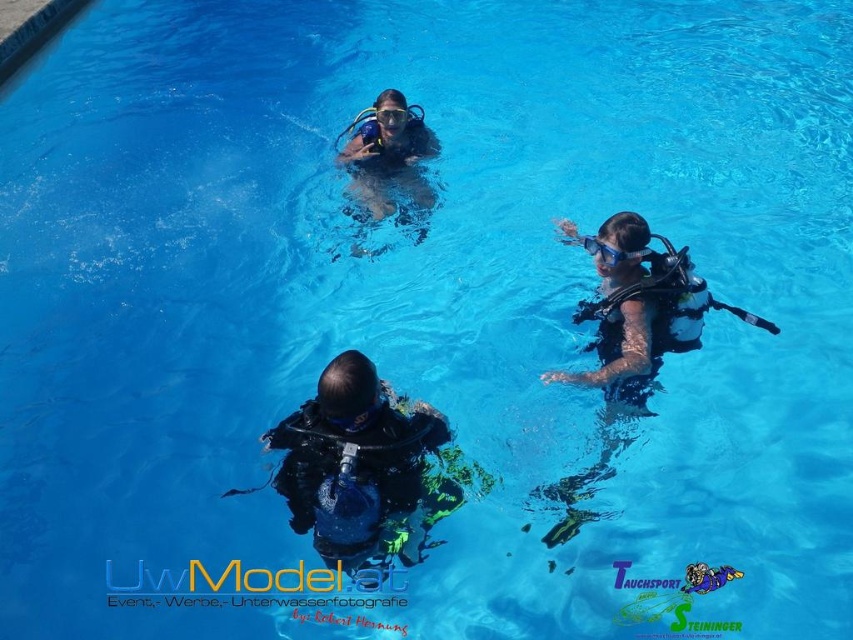
Question: Estimate the real-world distances between objects in this image. Which object is farther from the black matte scuba gear at center?

Choices:
 (A) matte black scuba gear at upper center
 (B) transparent rubber goggles at upper center

Answer: (A)

Question: Among these objects, which one is farthest from the camera?

Choices:
 (A) transparent rubber goggles at upper center
 (B) matte black scuba gear at upper center

Answer: (B)

Question: Does matte black scuba gear at upper center have a larger size compared to transparent rubber goggles at upper center?

Choices:
 (A) yes
 (B) no

Answer: (A)

Question: Is the position of matte black scuba gear at upper center less distant than that of transparent rubber goggles at upper center?

Choices:
 (A) yes
 (B) no

Answer: (B)

Question: Does black matte scuba gear at center lie behind transparent rubber goggles at upper center?

Choices:
 (A) yes
 (B) no

Answer: (B)

Question: Which of the following is the closest to the observer?

Choices:
 (A) matte black scuba gear at upper center
 (B) transparent rubber goggles at upper center

Answer: (B)